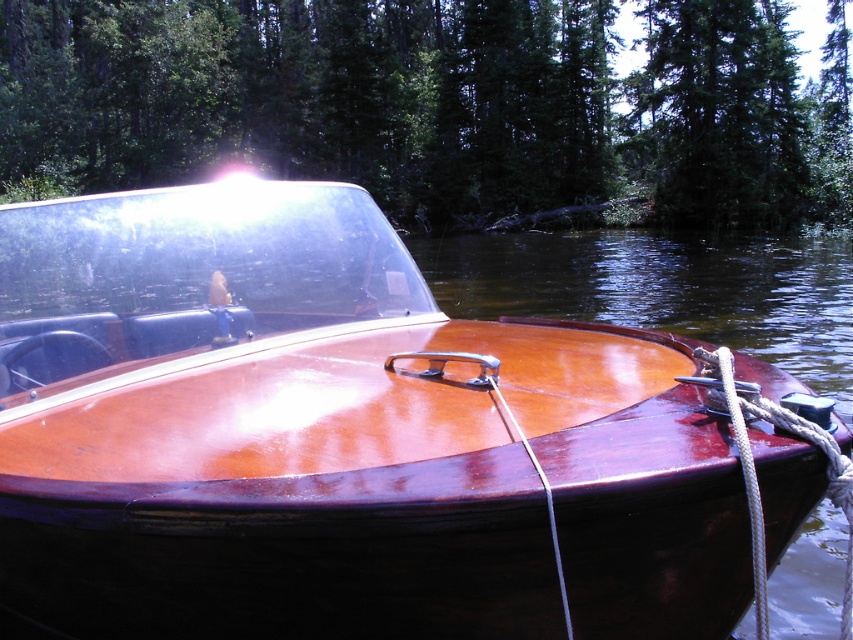
Question: Considering the relative positions of glossy wood boat at center and green matte tree at upper center in the image provided, where is glossy wood boat at center located with respect to green matte tree at upper center?

Choices:
 (A) left
 (B) right

Answer: (B)

Question: Can you confirm if glossy wood boat at center is thinner than green matte tree at upper center?

Choices:
 (A) no
 (B) yes

Answer: (B)

Question: Among these points, which one is nearest to the camera?

Choices:
 (A) (x=485, y=484)
 (B) (x=686, y=77)

Answer: (A)

Question: Observing the image, what is the correct spatial positioning of glossy wood boat at center in reference to green matte tree at upper center?

Choices:
 (A) above
 (B) below

Answer: (B)

Question: Which object is closer to the camera taking this photo?

Choices:
 (A) green matte tree at upper center
 (B) glossy wood boat at center

Answer: (B)

Question: Which of the following is the closest to the observer?

Choices:
 (A) glossy wood boat at center
 (B) green matte tree at upper center

Answer: (A)